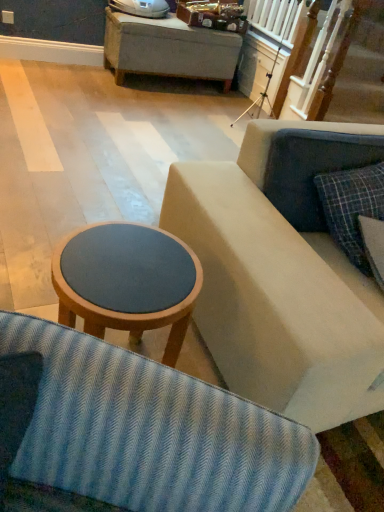
The height and width of the screenshot is (512, 384). I want to click on blank space above matte wood stool at center (from a real-world perspective), so click(x=130, y=265).